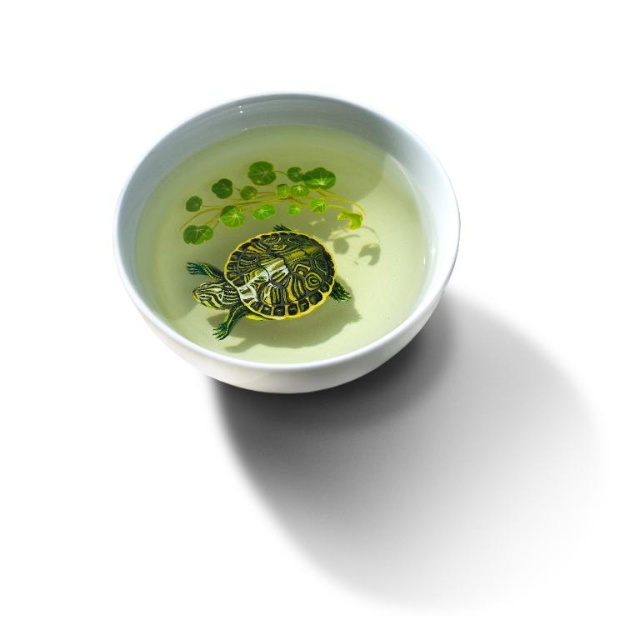
Question: Which point is closer to the camera?

Choices:
 (A) white ceramic bowl at center
 (B) shiny green tortoise at center

Answer: (A)

Question: Is white ceramic bowl at center bigger than shiny green tortoise at center?

Choices:
 (A) yes
 (B) no

Answer: (A)

Question: Which of the following is the closest to the observer?

Choices:
 (A) (422, 323)
 (B) (296, 282)

Answer: (A)

Question: Does white ceramic bowl at center have a lesser width compared to shiny green tortoise at center?

Choices:
 (A) yes
 (B) no

Answer: (B)

Question: Which point is closer to the camera?

Choices:
 (A) shiny green tortoise at center
 (B) white ceramic bowl at center

Answer: (B)

Question: Can you confirm if white ceramic bowl at center is positioned to the left of shiny green tortoise at center?

Choices:
 (A) no
 (B) yes

Answer: (A)